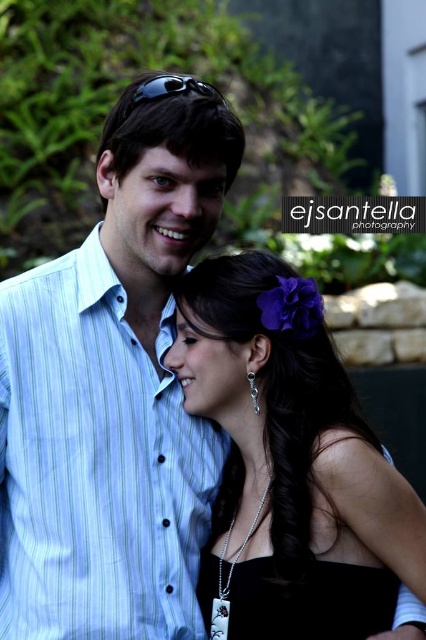
Question: Observing the image, what is the correct spatial positioning of blue striped shirt at upper left in reference to black plastic sunglasses at upper center?

Choices:
 (A) left
 (B) right

Answer: (A)

Question: Is black satin dress at center bigger than black plastic sunglasses at upper center?

Choices:
 (A) no
 (B) yes

Answer: (B)

Question: Which object is positioned farthest from the black satin dress at center?

Choices:
 (A) black plastic sunglasses at upper center
 (B) blue striped shirt at upper left

Answer: (A)

Question: Does blue striped shirt at upper left come behind black satin dress at center?

Choices:
 (A) no
 (B) yes

Answer: (A)

Question: Which of the following is the farthest from the observer?

Choices:
 (A) (233, 278)
 (B) (140, 540)

Answer: (A)

Question: Which is nearer to the blue striped shirt at upper left?

Choices:
 (A) black plastic sunglasses at upper center
 (B) black satin dress at center

Answer: (B)